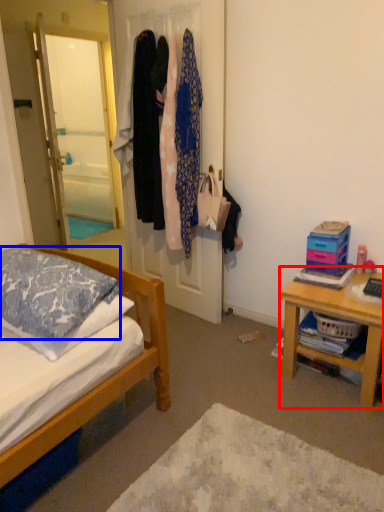
Question: Which object appears closest to the camera in this image, desk (highlighted by a red box) or pillow (highlighted by a blue box)?

Choices:
 (A) desk
 (B) pillow

Answer: (B)